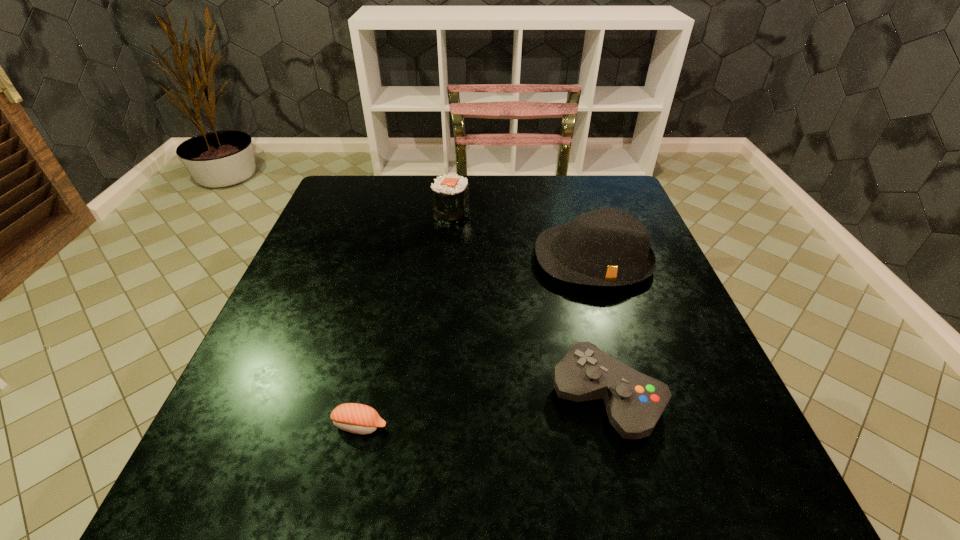
Locate an element on the screen. The image size is (960, 540). object that is the nearest to the nearer sushi is located at coordinates (634, 402).

What are the coordinates of `free space that satisfies the following two spatial constraints: 1. on the back side of the shorter sushi; 2. on the right side of the farthest object` in the screenshot? It's located at (408, 211).